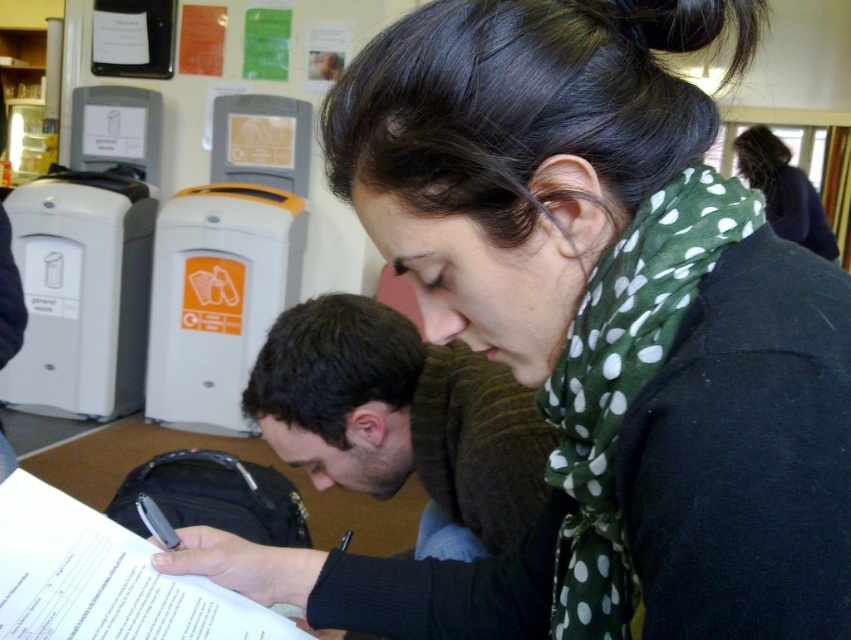
Can you confirm if white paper at lower left is shorter than green polka dot scarf at upper right?

Indeed, white paper at lower left has a lesser height compared to green polka dot scarf at upper right.

Is white paper at lower left smaller than green polka dot scarf at upper right?

Yes, white paper at lower left is smaller than green polka dot scarf at upper right.

At what (x,y) coordinates should I click in order to perform the action: click on white paper at lower left. Please return your answer as a coordinate pair (x, y). Looking at the image, I should click on tap(104, 579).

Can you confirm if dark brown hair at center is thinner than white paper at lower left?

Incorrect, dark brown hair at center's width is not less than white paper at lower left's.

Measure the distance between dark brown hair at center and camera.

dark brown hair at center is 86.49 centimeters from camera.

The height and width of the screenshot is (640, 851). Identify the location of dark brown hair at center. (401, 419).

Can you confirm if dark brown hair at center is positioned below green polka dot scarf at upper right?

Correct, dark brown hair at center is located below green polka dot scarf at upper right.

Does dark brown hair at center have a greater width compared to green polka dot scarf at upper right?

Incorrect, dark brown hair at center's width does not surpass green polka dot scarf at upper right's.

Describe the element at coordinates (401, 419) in the screenshot. I see `dark brown hair at center` at that location.

Locate an element on the screen. dark brown hair at center is located at coordinates (401, 419).